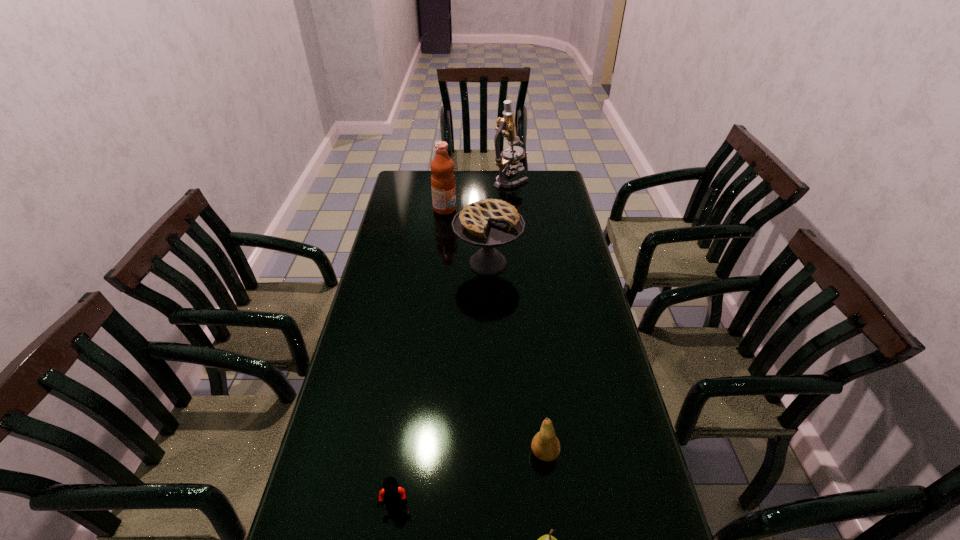
At what (x,y) coordinates should I click in order to perform the action: click on vacant space located 0.190m on the front label of the fruit juice. Please return your answer as a coordinate pair (x, y). The image size is (960, 540). Looking at the image, I should click on (500, 209).

At what (x,y) coordinates should I click in order to perform the action: click on free space located on the cut side of the pie. Please return your answer as a coordinate pair (x, y). Looking at the image, I should click on (490, 362).

Locate an element on the screen. This screenshot has height=540, width=960. blank space located on the back of the farther pear is located at coordinates (531, 336).

Locate an element on the screen. The height and width of the screenshot is (540, 960). object present at the far edge is located at coordinates (504, 159).

Locate an element on the screen. The image size is (960, 540). blank area at the far edge is located at coordinates (489, 178).

At what (x,y) coordinates should I click in order to perform the action: click on free spot at the left edge of the desktop. Please return your answer as a coordinate pair (x, y). This screenshot has height=540, width=960. Looking at the image, I should click on (368, 310).

The image size is (960, 540). Find the location of `free region at the right edge`. free region at the right edge is located at coordinates (559, 269).

At what (x,y) coordinates should I click in order to perform the action: click on object that can be found as the fourth closest to the Lego. Please return your answer as a coordinate pair (x, y). This screenshot has height=540, width=960. Looking at the image, I should click on (443, 187).

Identify the location of object that stands as the second closest to the shorter pear. The image size is (960, 540). (392, 494).

You are a GUI agent. You are given a task and a screenshot of the screen. Output one action in this format:
    pyautogui.click(x=<x>, y=<y>)
    Task: Click on the second closest pear to the Lego
    This screenshot has height=540, width=960.
    Given the screenshot: What is the action you would take?
    pyautogui.click(x=545, y=445)